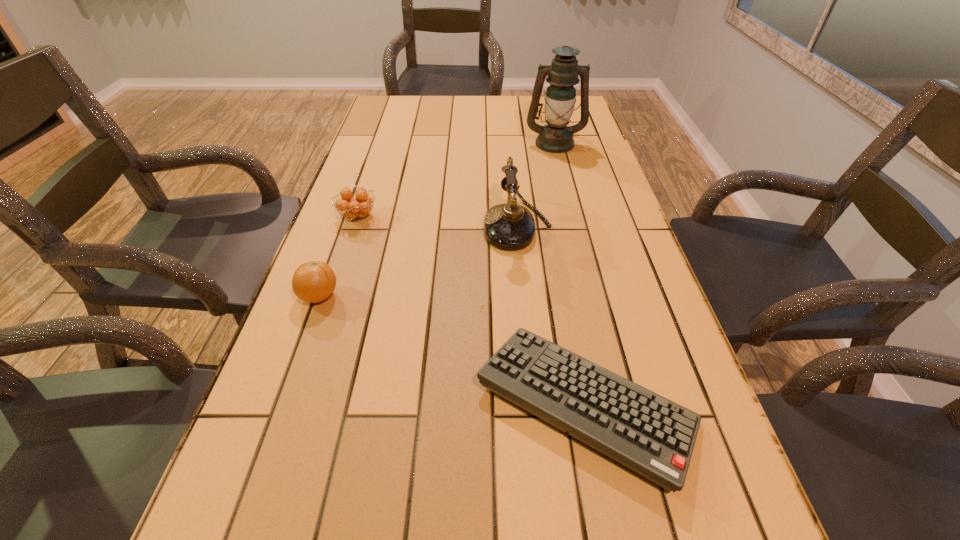
Where is `the tallest object`? Image resolution: width=960 pixels, height=540 pixels. the tallest object is located at coordinates (556, 137).

Identify the location of the farthest object. This screenshot has height=540, width=960. (556, 137).

The image size is (960, 540). What are the coordinates of `telephone` in the screenshot? It's located at (510, 226).

You are a GUI agent. You are given a task and a screenshot of the screen. Output one action in this format:
    pyautogui.click(x=<x>, y=<y>)
    Task: Click on the second nearest object
    Image resolution: width=960 pixels, height=540 pixels.
    Given the screenshot: What is the action you would take?
    pyautogui.click(x=313, y=282)

The width and height of the screenshot is (960, 540). I want to click on the farther orange fruit, so click(x=356, y=208).

Where is `the nearest object`? The height and width of the screenshot is (540, 960). the nearest object is located at coordinates (642, 430).

At what (x,y) coordinates should I click in order to perform the action: click on the shortest object. Please return your answer as a coordinate pair (x, y). The width and height of the screenshot is (960, 540). Looking at the image, I should click on (642, 430).

The width and height of the screenshot is (960, 540). I want to click on vacant area located 0.120m on the left of the farthest object, so click(489, 143).

Image resolution: width=960 pixels, height=540 pixels. Identify the location of free space located 0.200m on the dial of the fourth shortest object. (406, 226).

Identify the location of free location located on the dial of the fourth shortest object. (379, 226).